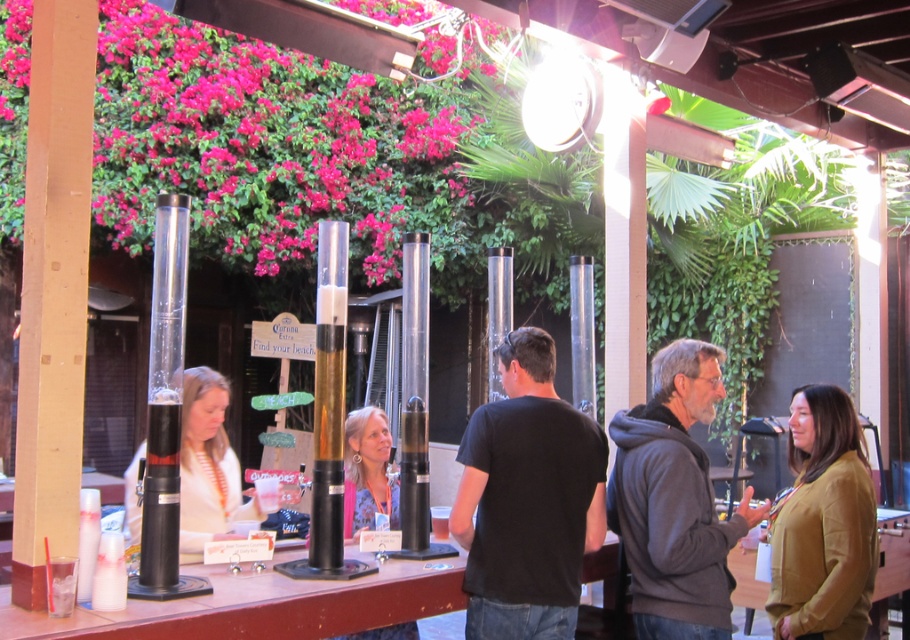
Does white striped shirt at left have a larger size compared to wooden table at lower right?

Actually, white striped shirt at left might be smaller than wooden table at lower right.

The width and height of the screenshot is (910, 640). What do you see at coordinates (207, 467) in the screenshot?
I see `white striped shirt at left` at bounding box center [207, 467].

This screenshot has height=640, width=910. Identify the location of white striped shirt at left. click(x=207, y=467).

At what (x,y) coordinates should I click in order to perform the action: click on black t-shirt at center. Please return your answer as a coordinate pair (x, y). The width and height of the screenshot is (910, 640). Looking at the image, I should click on (527, 499).

Between point (503, 480) and point (219, 474), which one is positioned in front?

Positioned in front is point (503, 480).

Locate an element on the screen. black t-shirt at center is located at coordinates (527, 499).

Can you confirm if velvet mustard jacket at lower right is positioned to the right of floral-patterned blouse at center?

Indeed, velvet mustard jacket at lower right is positioned on the right side of floral-patterned blouse at center.

Does velvet mustard jacket at lower right have a lesser width compared to floral-patterned blouse at center?

No.

Where is `velvet mustard jacket at lower right`? Image resolution: width=910 pixels, height=640 pixels. velvet mustard jacket at lower right is located at coordinates (823, 524).

The width and height of the screenshot is (910, 640). Find the location of `velvet mustard jacket at lower right`. velvet mustard jacket at lower right is located at coordinates (823, 524).